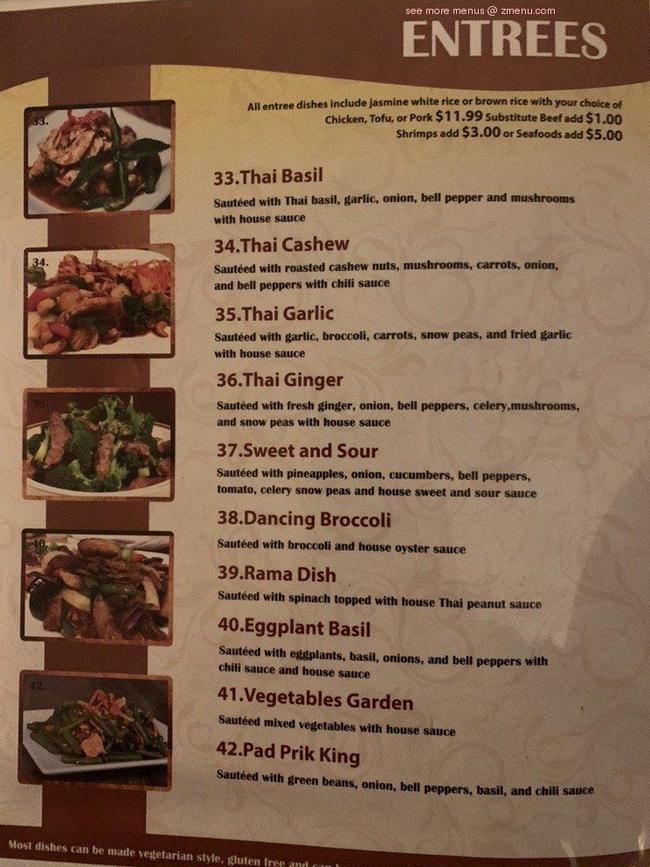
Locate an element on the screen. This screenshot has height=867, width=650. note at bottom of menu is located at coordinates (149, 855).